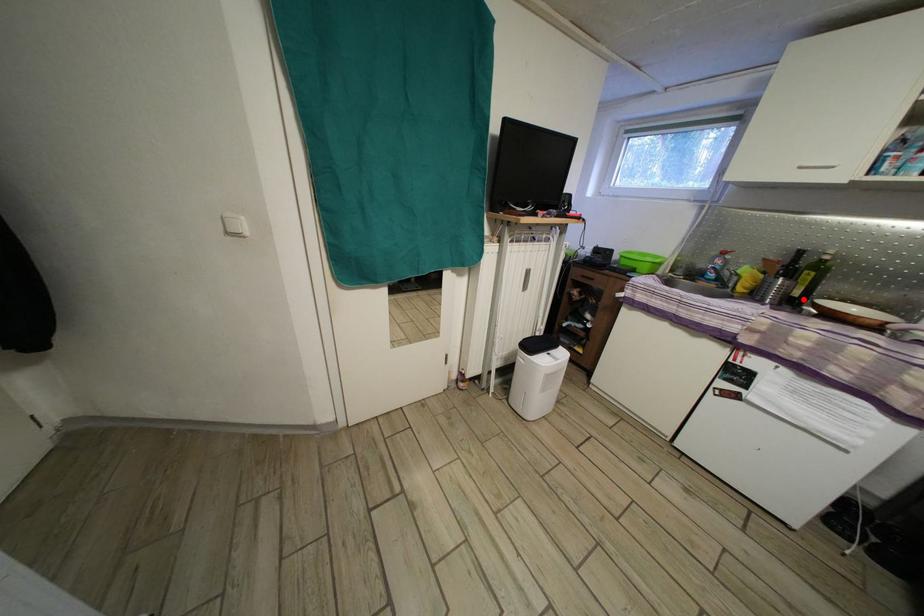
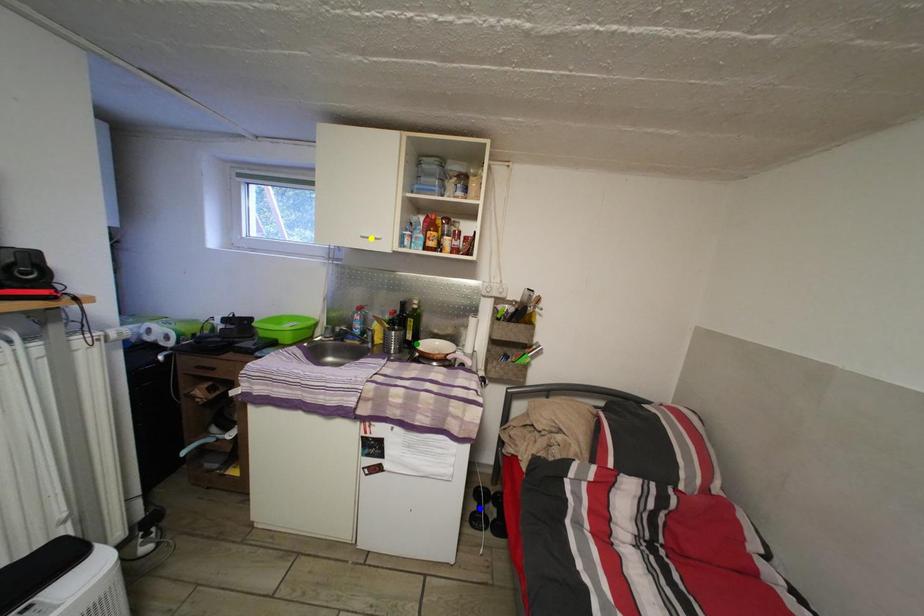
Question: I am providing you with two images of the same scene from different viewpoints. A red point is marked on the first image. You are given multiple points on the second image. Which point in image 2 is actually the same real-world point as the red point in image 1?

Choices:
 (A) blue point
 (B) green point
 (C) yellow point

Answer: (B)